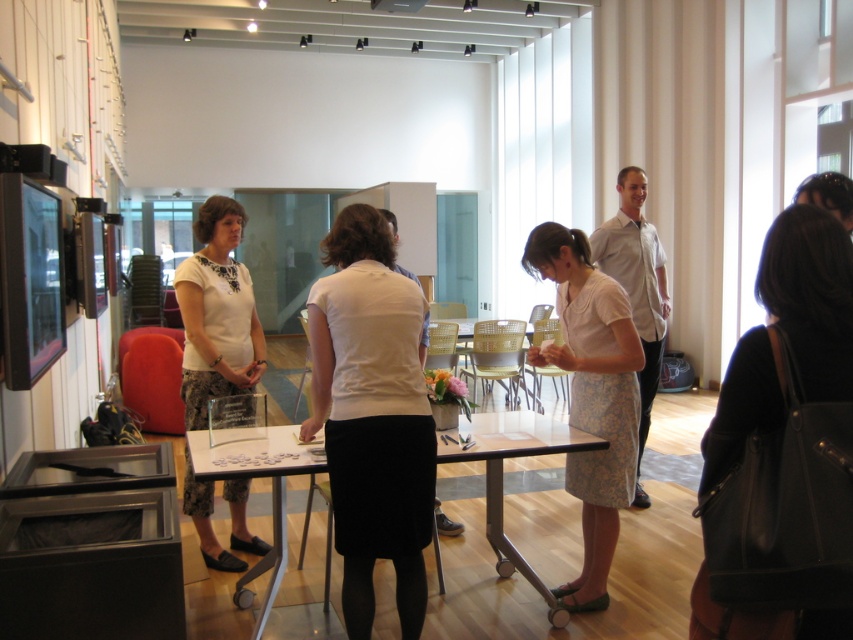
Question: Based on their relative distances, which object is nearer to the floral-patterned skirt at center?

Choices:
 (A) black leather bag at lower right
 (B) white matte blouse at center

Answer: (A)

Question: Based on their relative distances, which object is nearer to the white matte skirt at center?

Choices:
 (A) black leather bag at lower right
 (B) clear glass table at center

Answer: (B)

Question: Is white matte skirt at center above clear glass table at center?

Choices:
 (A) no
 (B) yes

Answer: (B)

Question: Does black leather bag at lower right have a larger size compared to floral-patterned skirt at center?

Choices:
 (A) no
 (B) yes

Answer: (A)

Question: Is floral-patterned skirt at center smaller than clear glass table at center?

Choices:
 (A) yes
 (B) no

Answer: (A)

Question: Which point is closer to the camera?

Choices:
 (A) (722, 492)
 (B) (202, 346)

Answer: (A)